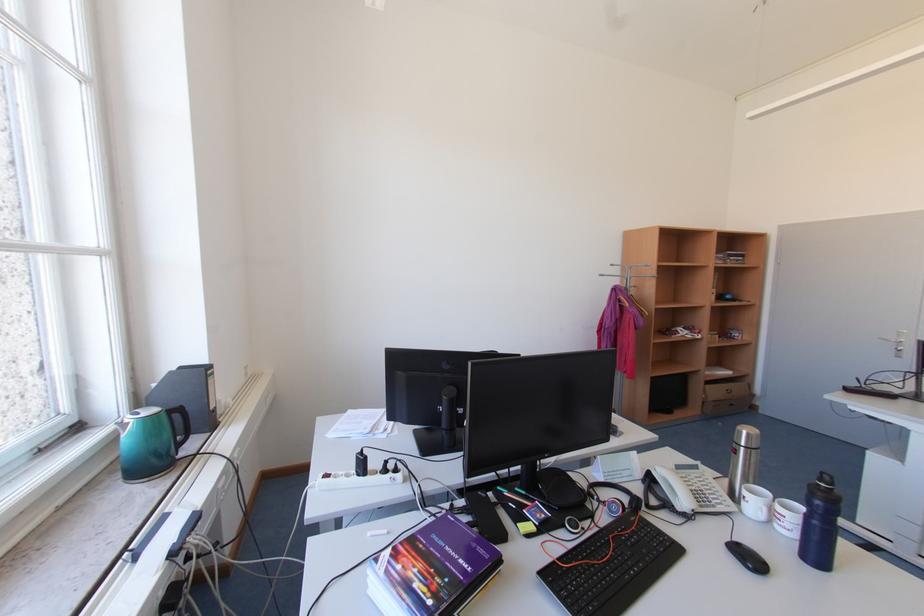
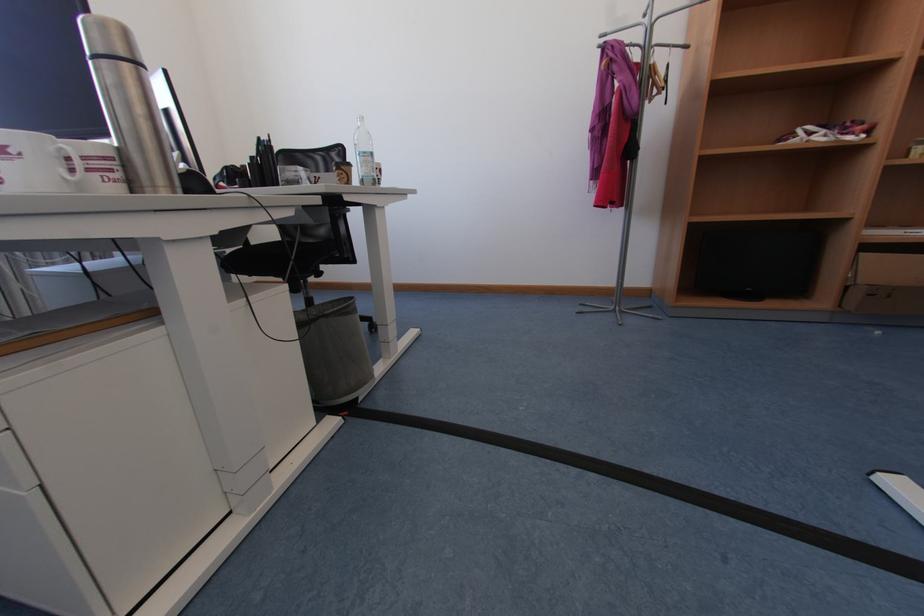
The point at (711, 403) is marked in the first image. Where is the corresponding point in the second image?

(855, 289)